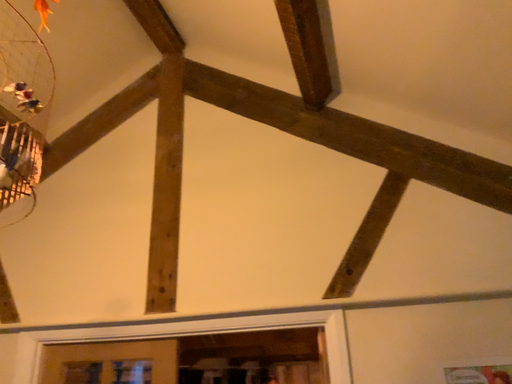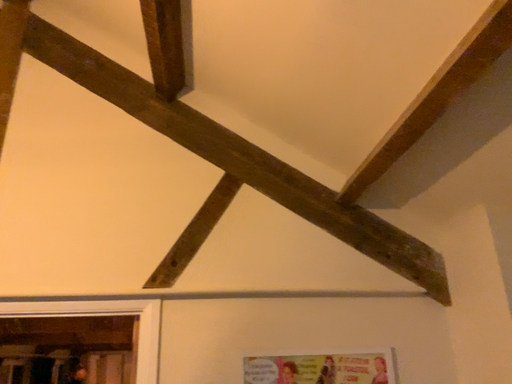
Question: How did the camera likely rotate when shooting the video?

Choices:
 (A) rotated left
 (B) rotated right

Answer: (B)